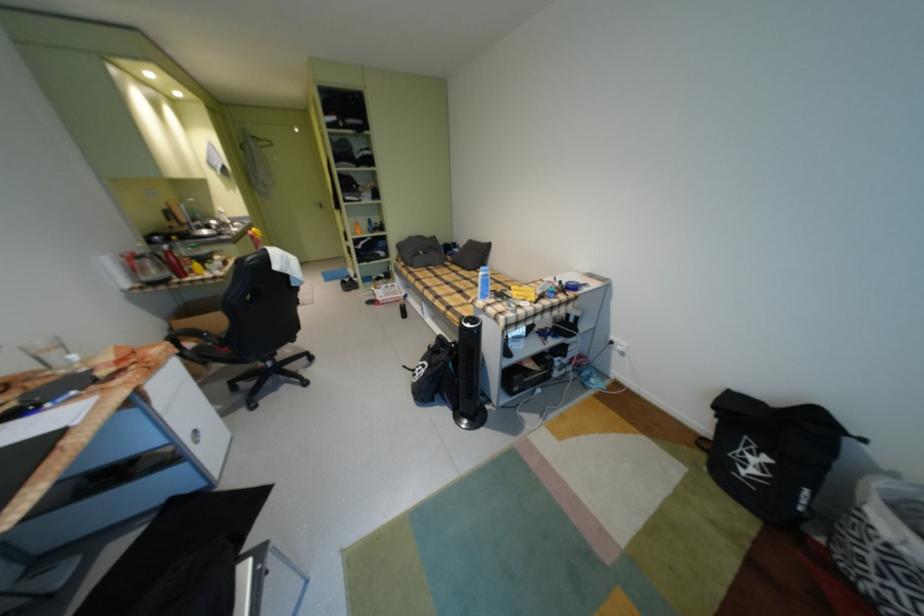
The height and width of the screenshot is (616, 924). What do you see at coordinates (252, 322) in the screenshot?
I see `a black chair seat` at bounding box center [252, 322].